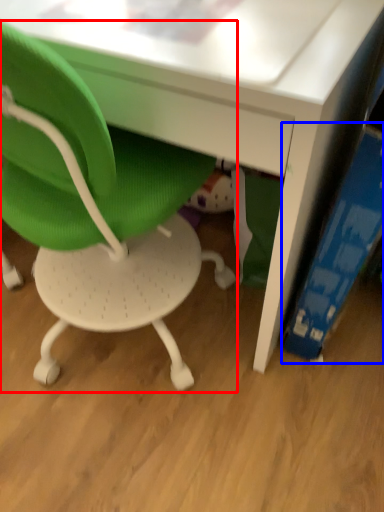
Question: Which object is closer to the camera taking this photo, chair (highlighted by a red box) or paperback book (highlighted by a blue box)?

Choices:
 (A) chair
 (B) paperback book

Answer: (A)